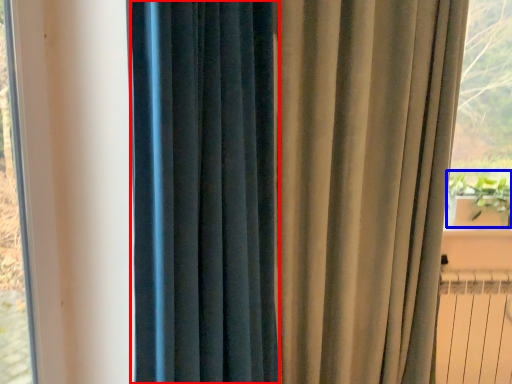
Question: Which object is further to the camera taking this photo, curtain (highlighted by a red box) or plant (highlighted by a blue box)?

Choices:
 (A) curtain
 (B) plant

Answer: (B)